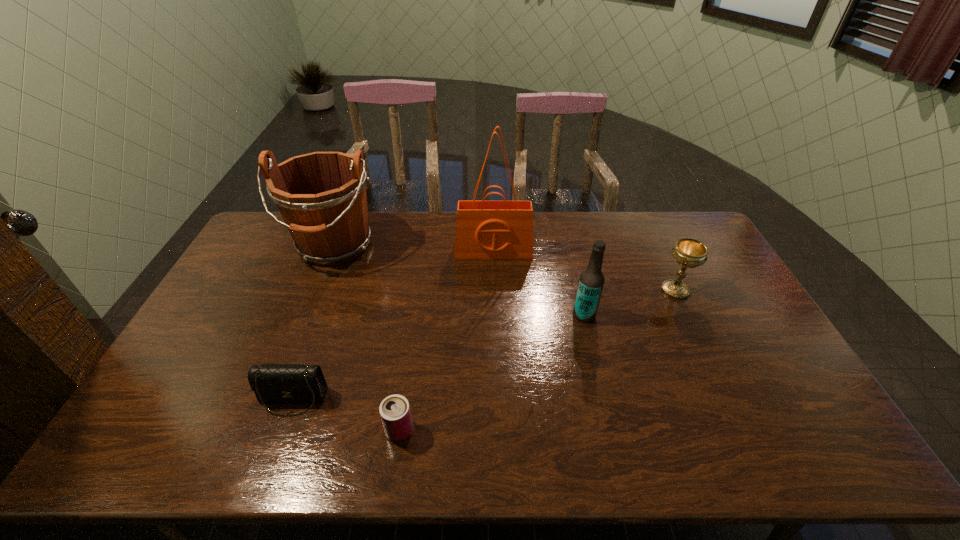
You are a GUI agent. You are given a task and a screenshot of the screen. Output one action in this format:
    pyautogui.click(x=<x>, y=<y>)
    Task: Click on the free spot that satisfies the following two spatial constraints: 1. on the front flap of the nearest object; 2. on the right side of the clutch bag
    The height and width of the screenshot is (540, 960).
    Given the screenshot: What is the action you would take?
    pyautogui.click(x=281, y=430)

Locate an element on the screen. free spot that satisfies the following two spatial constraints: 1. with the handle on the side of the fifth shortest object; 2. on the right side of the fourth object from right to left is located at coordinates (260, 430).

At what (x,y) coordinates should I click in order to perform the action: click on free spot that satisfies the following two spatial constraints: 1. on the logo side of the chalice; 2. on the left side of the tote bag. Please return your answer as a coordinate pair (x, y). The height and width of the screenshot is (540, 960). Looking at the image, I should click on (494, 291).